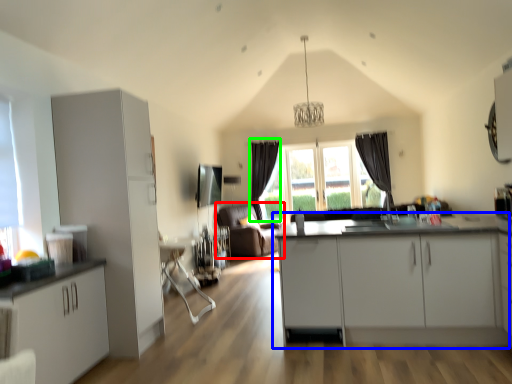
Question: Estimate the real-world distances between objects in this image. Which object is farther from couch (highlighted by a red box), cabinetry (highlighted by a blue box) or curtain (highlighted by a green box)?

Choices:
 (A) cabinetry
 (B) curtain

Answer: (A)